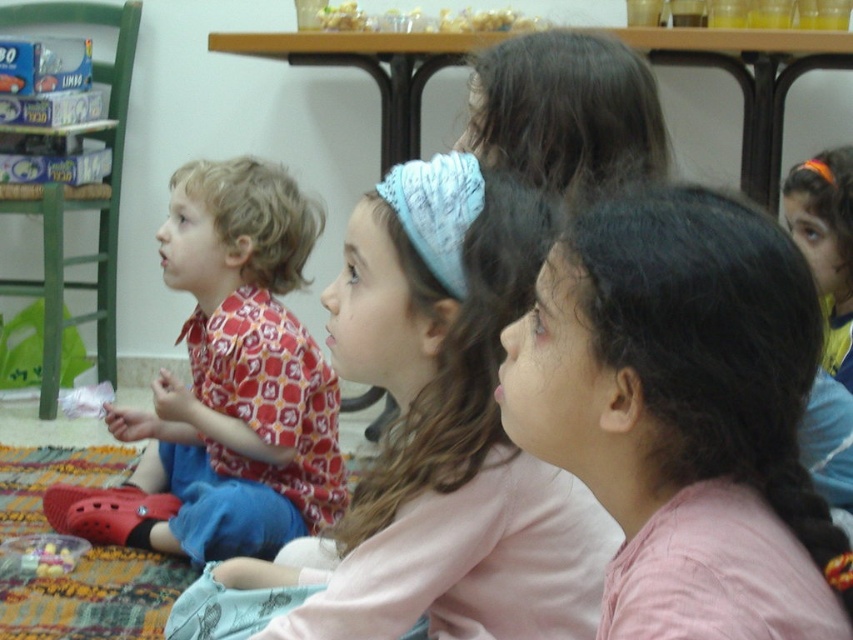
Question: Which object is positioned farthest from the pink fabric at center?

Choices:
 (A) red patterned shirt at left
 (B) plastic toy at lower left

Answer: (B)

Question: Is red patterned shirt at left thinner than plastic toy at lower left?

Choices:
 (A) yes
 (B) no

Answer: (B)

Question: Estimate the real-world distances between objects in this image. Which object is closer to the red patterned shirt at left?

Choices:
 (A) plastic toy at lower left
 (B) pink fabric at center
 (C) light pink fabric headband at center

Answer: (A)

Question: Which of these objects is positioned farthest from the light pink fabric headband at center?

Choices:
 (A) red patterned shirt at left
 (B) pink fabric at center
 (C) plastic toy at lower left

Answer: (C)

Question: Does light pink fabric headband at center have a lesser width compared to plastic toy at lower left?

Choices:
 (A) yes
 (B) no

Answer: (B)

Question: Is the position of light pink fabric headband at center more distant than that of red patterned shirt at left?

Choices:
 (A) yes
 (B) no

Answer: (B)